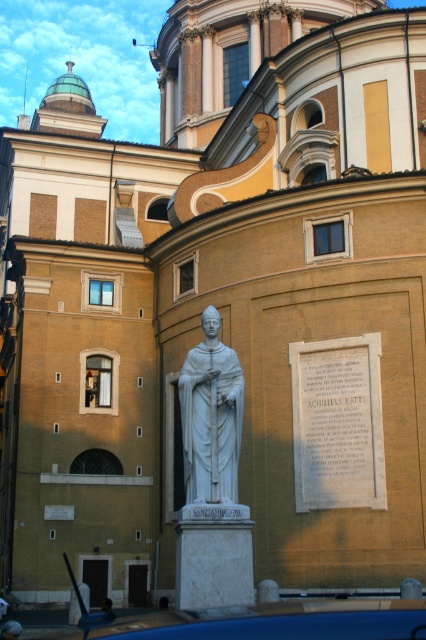
You are standing at the entrance of the historical Romanesque building and want to park your car. The parking lot has a designated parking spot at point 0.972, 0.657. Is the blue matte car at lower center currently occupying that spot?

The blue matte car at lower center is positioned at point (279, 621), so yes, it is occupying the designated parking spot at that location.

You are an architect designing a new sculpture garden and need to place a 2.5 meter tall statue. You have two options from the image, the blue matte car at lower center and the white marble statue at center. Which object would be more suitable for the garden if you want the statue to be at least 2.5 meters tall?

The blue matte car at lower center is taller than the white marble statue at center, so it would be more suitable for the garden since it meets the minimum height requirement of 2.5 meters.

You are a tour guide explaining the scene to visitors. You mention both the blue matte car at lower center and the white marble statue at center. Which object is bigger?

The blue matte car at lower center is larger in size compared to the white marble statue at center.